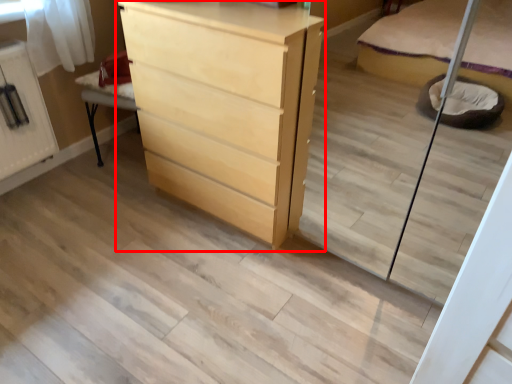
Question: From the image's perspective, what is the correct spatial relationship of chest of drawers (annotated by the red box) in relation to cabinetry?

Choices:
 (A) below
 (B) above

Answer: (A)